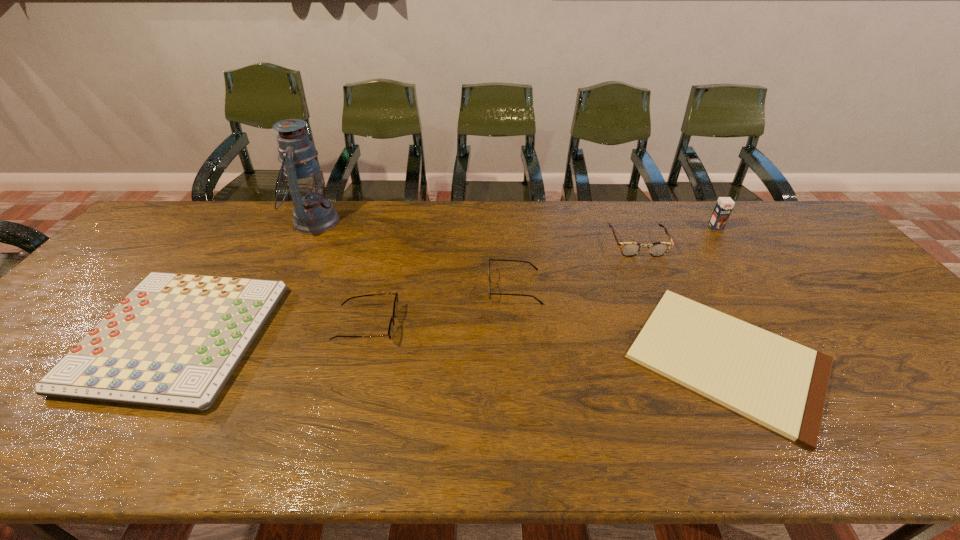
Identify the location of vacant space that satisfies the following two spatial constraints: 1. on the back side of the shortest object; 2. on the front-facing side of the lantern. (655, 222).

Where is `vacant space that satisfies the following two spatial constraints: 1. on the front-facing side of the second farthest spectacles; 2. on the back side of the shortest object`? This screenshot has height=540, width=960. vacant space that satisfies the following two spatial constraints: 1. on the front-facing side of the second farthest spectacles; 2. on the back side of the shortest object is located at coordinates (521, 359).

This screenshot has height=540, width=960. In order to click on free space in the image that satisfies the following two spatial constraints: 1. on the front-facing side of the fourth object from left to right; 2. on the front side of the gameboard in this screenshot , I will do `click(519, 336)`.